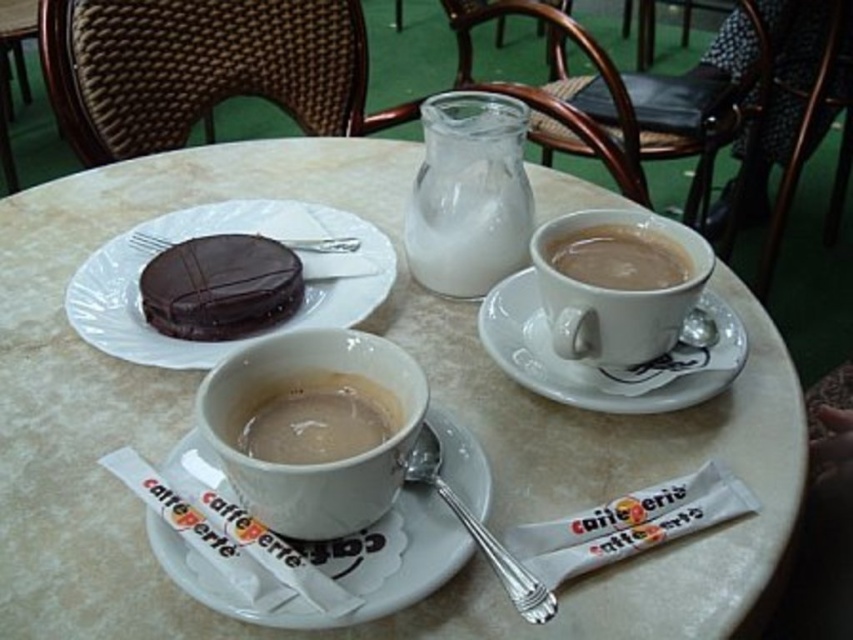
You are a customer at the cozy cafe and want to pour milk from the milky glass pitcher at center into the matte white cup at center. Can you reach the pitcher before the cup?

The milky glass pitcher at center is positioned on the right side of matte white cup at center, so you can reach the pitcher first if you approach from the right side.

You are a barista trying to place the milky glass pitcher at center on the table. The table has a coordinate system where the bottom left corner is the origin. Where should you place the pitcher to ensure it stays centered?

The milky glass pitcher at center should be placed at point [469,195] to stay centered according to its current position.

You are a customer in the cafe and want to know if the chocolate glazed cake at center can fit on the saucer of the brown matte cup at upper right. Can it?

The chocolate glazed cake at center is larger than the brown matte cup at upper right. Since the cake is bigger, it might not fit on the saucer of the brown matte cup at upper right unless the saucer is also large enough. However, the description only mentions the cake is larger than the cup, not the saucer. Without information about the saucer size, it is uncertain.